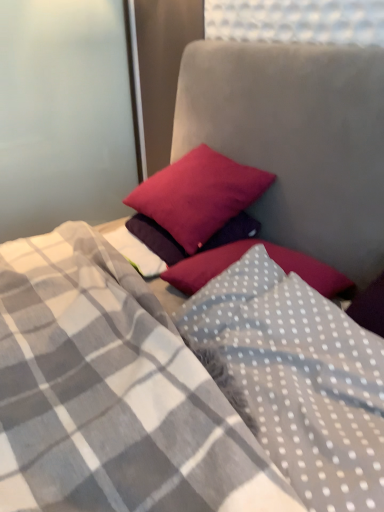
Question: In which direction should I rotate to look at white dotted fabric pillow at center, the first pillow viewed from the front?

Choices:
 (A) right
 (B) left

Answer: (A)

Question: From a real-world perspective, is white dotted fabric pillow at center, which is counted as the 2th pillow, starting from the top, over matte pink pillow at upper center, positioned as the 2th pillow in front-to-back order?

Choices:
 (A) yes
 (B) no

Answer: (B)

Question: Would you say matte pink pillow at upper center, which is counted as the first pillow, starting from the back, is part of white dotted fabric pillow at center, which is the 1th pillow from bottom to top,'s contents?

Choices:
 (A) yes
 (B) no

Answer: (B)

Question: Is white dotted fabric pillow at center, the first pillow viewed from the front, at the right side of matte pink pillow at upper center, positioned as the first pillow in top-to-bottom order?

Choices:
 (A) yes
 (B) no

Answer: (A)

Question: Is white dotted fabric pillow at center, which is the 1th pillow from bottom to top, wider than matte pink pillow at upper center, the 2th pillow when ordered from bottom to top?

Choices:
 (A) no
 (B) yes

Answer: (B)

Question: From a real-world perspective, is white dotted fabric pillow at center, which is counted as the 2th pillow, starting from the top, positioned under matte pink pillow at upper center, positioned as the 2th pillow in front-to-back order, based on gravity?

Choices:
 (A) no
 (B) yes

Answer: (B)

Question: Is white dotted fabric pillow at center, which ranks as the second pillow in back-to-front order, behind matte pink pillow at upper center, positioned as the 2th pillow in front-to-back order?

Choices:
 (A) no
 (B) yes

Answer: (A)

Question: Is matte pink pillow at upper center, positioned as the first pillow in top-to-bottom order, at the right side of white dotted fabric pillow at center, which is the 1th pillow from bottom to top?

Choices:
 (A) no
 (B) yes

Answer: (A)

Question: Can you confirm if matte pink pillow at upper center, the 2th pillow when ordered from bottom to top, is wider than white dotted fabric pillow at center, which is the 1th pillow from bottom to top?

Choices:
 (A) yes
 (B) no

Answer: (B)

Question: Is there a large distance between matte pink pillow at upper center, which is counted as the first pillow, starting from the back, and white dotted fabric pillow at center, which ranks as the second pillow in back-to-front order?

Choices:
 (A) yes
 (B) no

Answer: (B)

Question: Is matte pink pillow at upper center, which is counted as the first pillow, starting from the back, to the left of white dotted fabric pillow at center, which is the 1th pillow from bottom to top, from the viewer's perspective?

Choices:
 (A) no
 (B) yes

Answer: (B)

Question: Is matte pink pillow at upper center, the 2th pillow when ordered from bottom to top, positioned behind white dotted fabric pillow at center, the first pillow viewed from the front?

Choices:
 (A) no
 (B) yes

Answer: (B)

Question: Could you tell me if matte pink pillow at upper center, positioned as the 2th pillow in front-to-back order, is turned towards white dotted fabric pillow at center, which ranks as the second pillow in back-to-front order?

Choices:
 (A) yes
 (B) no

Answer: (B)

Question: From the image's perspective, is matte pink pillow at upper center, positioned as the 2th pillow in front-to-back order, located above or below white dotted fabric pillow at center, which is counted as the 2th pillow, starting from the top?

Choices:
 (A) above
 (B) below

Answer: (A)